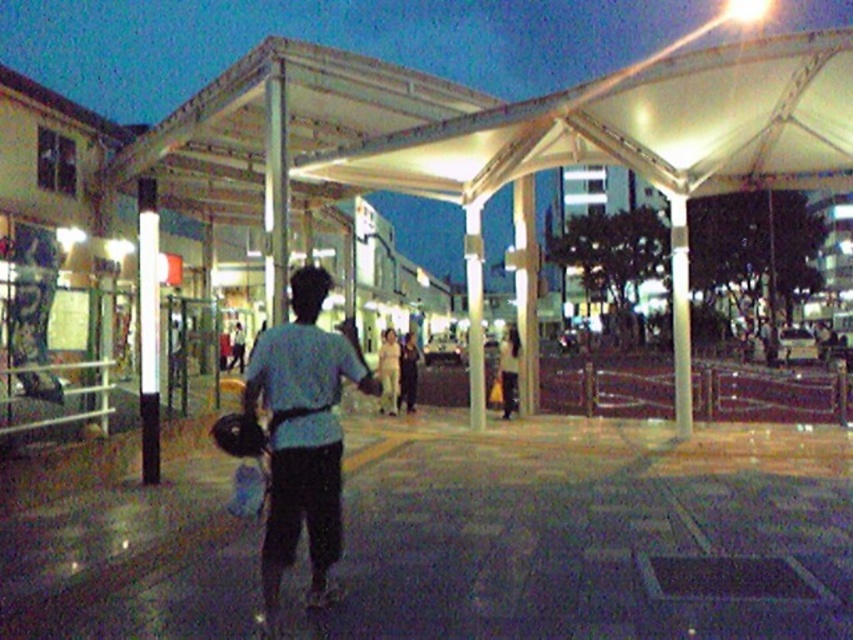
Does light beige fabric pants at center appear on the right side of light beige fabric bag at center?

Incorrect, light beige fabric pants at center is not on the right side of light beige fabric bag at center.

Image resolution: width=853 pixels, height=640 pixels. What are the coordinates of `light beige fabric pants at center` in the screenshot? It's located at (387, 371).

Is point (730, 120) more distant than point (294, 512)?

That is True.

Measure the distance between white translucent canopy at upper center and camera.

They are 35.27 feet apart.

I want to click on white translucent canopy at upper center, so click(639, 128).

Which of these two, white translucent canopy at upper center or light beige fabric pants at center, stands taller?

With more height is white translucent canopy at upper center.

Does white translucent canopy at upper center have a lesser height compared to light beige fabric pants at center?

Incorrect, white translucent canopy at upper center's height does not fall short of light beige fabric pants at center's.

Image resolution: width=853 pixels, height=640 pixels. Identify the location of white translucent canopy at upper center. (639, 128).